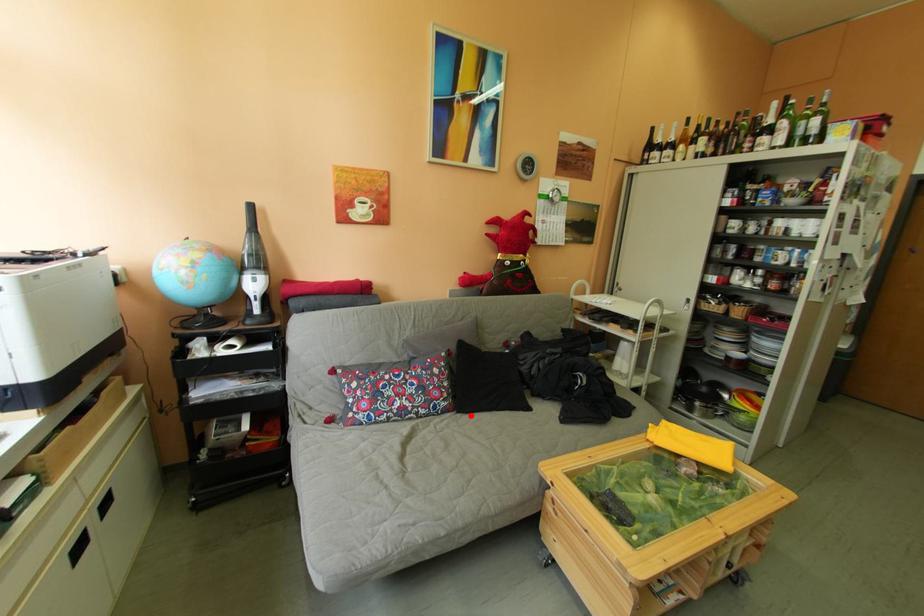
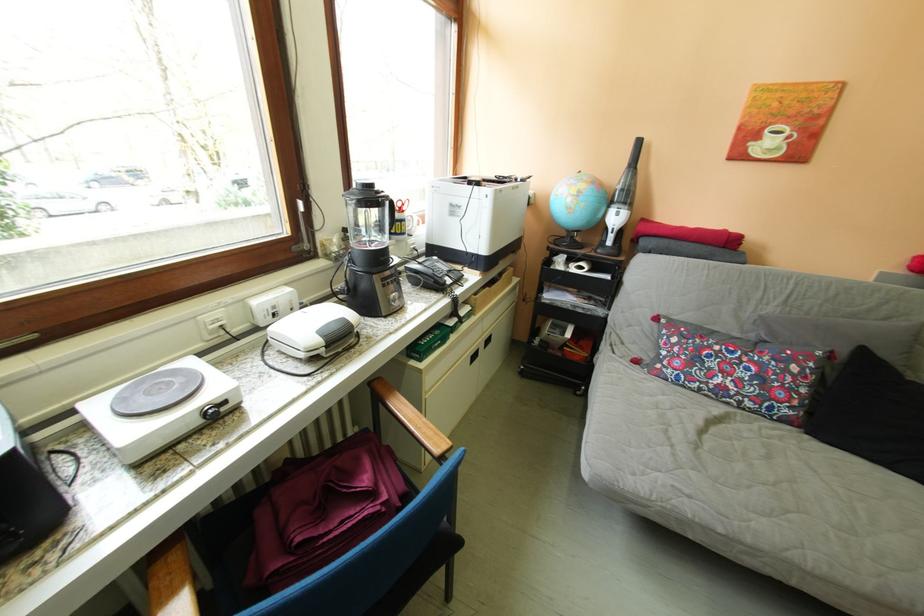
Find the pixel in the second image that matches the highlighted location in the first image.

(821, 437)